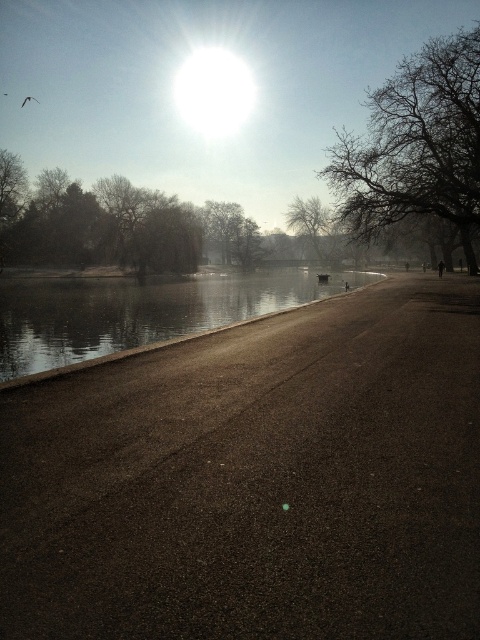
Question: Which object is closer to the camera taking this photo?

Choices:
 (A) green leafy tree at upper left
 (B) smooth concrete river at center
 (C) bare branches at center
 (D) bare branches at upper right

Answer: (B)

Question: Which of these objects is positioned farthest from the smooth concrete river at center?

Choices:
 (A) green leafy tree at upper left
 (B) bare branches at upper right
 (C) bare branches at center

Answer: (C)

Question: Is smooth concrete river at center positioned before bare branches at center?

Choices:
 (A) no
 (B) yes

Answer: (B)

Question: Can you confirm if smooth concrete river at center is positioned to the left of green leafy tree at upper left?

Choices:
 (A) yes
 (B) no

Answer: (B)

Question: Which point is farther to the camera?

Choices:
 (A) bare branches at center
 (B) bare branches at upper right
 (C) smooth concrete river at center

Answer: (A)

Question: Does bare branches at upper right have a larger size compared to green leafy tree at upper left?

Choices:
 (A) yes
 (B) no

Answer: (A)